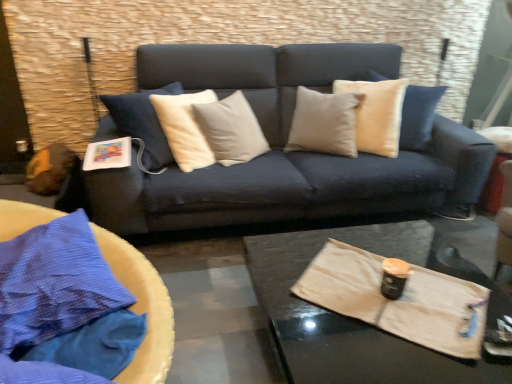
Question: From the image's perspective, is wooden tray at center below blue fabric at left?

Choices:
 (A) no
 (B) yes

Answer: (B)

Question: Is wooden tray at center directly adjacent to blue fabric at left?

Choices:
 (A) yes
 (B) no

Answer: (B)

Question: Can blue fabric at left be found inside wooden tray at center?

Choices:
 (A) no
 (B) yes

Answer: (A)

Question: Does wooden tray at center lie in front of blue fabric at left?

Choices:
 (A) yes
 (B) no

Answer: (B)

Question: Is wooden tray at center not inside blue fabric at left?

Choices:
 (A) no
 (B) yes

Answer: (B)

Question: Is wooden tray at center positioned with its back to blue fabric at left?

Choices:
 (A) yes
 (B) no

Answer: (B)

Question: Considering the relative positions of wooden tray at center and black matte can at center in the image provided, is wooden tray at center behind black matte can at center?

Choices:
 (A) no
 (B) yes

Answer: (A)

Question: Is wooden tray at center not within black matte can at center?

Choices:
 (A) yes
 (B) no

Answer: (A)

Question: Is wooden tray at center facing away from black matte can at center?

Choices:
 (A) no
 (B) yes

Answer: (A)

Question: Is the depth of wooden tray at center less than that of black matte can at center?

Choices:
 (A) no
 (B) yes

Answer: (B)

Question: From the image's perspective, is wooden tray at center located above black matte can at center?

Choices:
 (A) yes
 (B) no

Answer: (B)

Question: Would you consider wooden tray at center to be distant from black matte can at center?

Choices:
 (A) yes
 (B) no

Answer: (B)

Question: Can you confirm if blue fabric at left is bigger than black matte can at center?

Choices:
 (A) no
 (B) yes

Answer: (B)